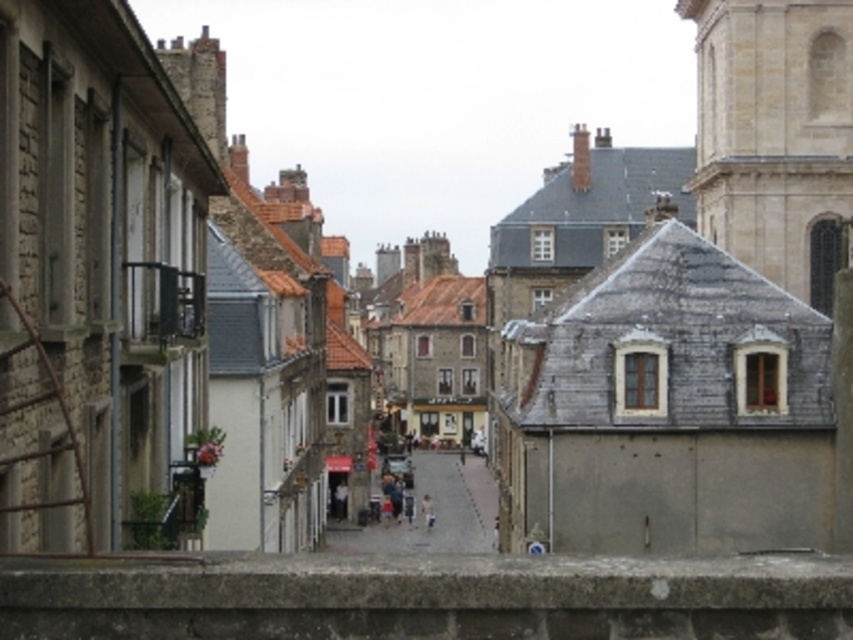
Question: Based on their relative distances, which object is nearer to the concrete ledge at lower center?

Choices:
 (A) beige stone tower at upper right
 (B) smooth stone alley at center

Answer: (A)

Question: Estimate the real-world distances between objects in this image. Which object is closer to the beige stone tower at upper right?

Choices:
 (A) concrete ledge at lower center
 (B) smooth stone alley at center

Answer: (B)

Question: Does concrete ledge at lower center appear over beige stone tower at upper right?

Choices:
 (A) yes
 (B) no

Answer: (B)

Question: Among these points, which one is nearest to the camera?

Choices:
 (A) (469, 545)
 (B) (811, 84)

Answer: (B)

Question: Does concrete ledge at lower center come in front of smooth stone alley at center?

Choices:
 (A) no
 (B) yes

Answer: (B)

Question: Is concrete ledge at lower center to the right of beige stone tower at upper right from the viewer's perspective?

Choices:
 (A) yes
 (B) no

Answer: (B)